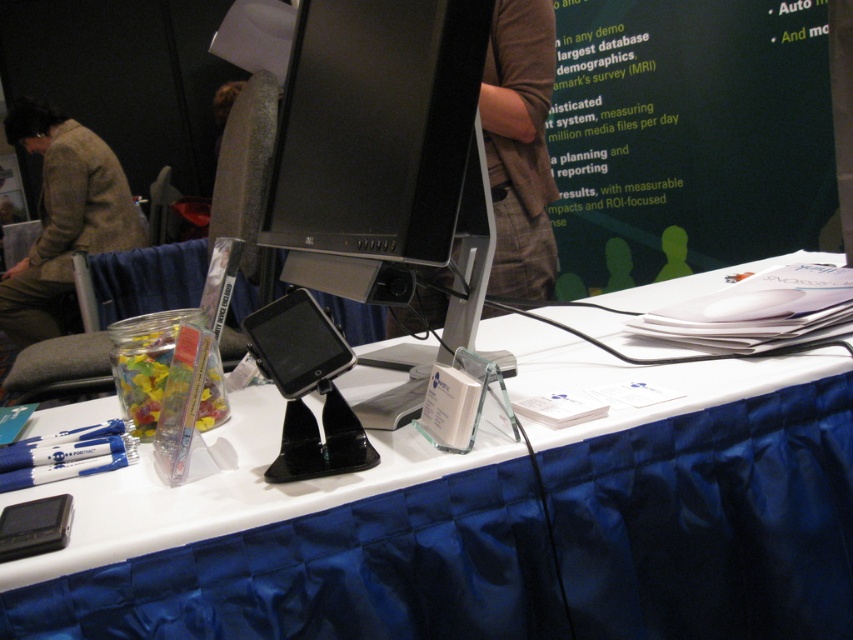
Question: Is black glossy monitor at center below brown plaid shirt at upper center?

Choices:
 (A) yes
 (B) no

Answer: (A)

Question: Can you confirm if black glossy monitor at center is positioned to the left of brown textured jacket at upper left?

Choices:
 (A) yes
 (B) no

Answer: (B)

Question: Which object is the closest to the black glossy monitor at center?

Choices:
 (A) white glossy table at center
 (B) brown plaid shirt at upper center
 (C) brown textured jacket at upper left

Answer: (A)

Question: Which point is farther to the camera?

Choices:
 (A) (149, 538)
 (B) (56, 278)
 (C) (491, 13)
 (D) (538, 176)

Answer: (B)

Question: Which object is the farthest from the brown plaid shirt at upper center?

Choices:
 (A) white glossy table at center
 (B) black glossy monitor at center

Answer: (B)

Question: Does brown plaid shirt at upper center have a greater width compared to brown textured jacket at upper left?

Choices:
 (A) no
 (B) yes

Answer: (A)